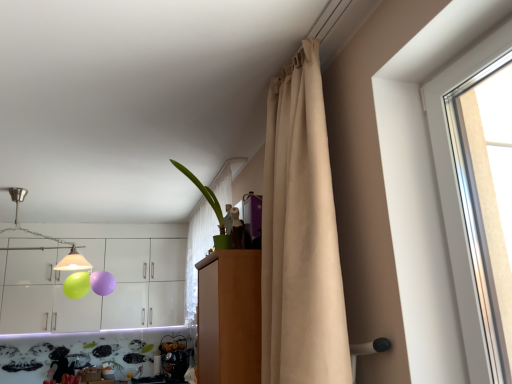
Question: Would you say brushed metal lampshade at upper left is outside wooden cabinet at center?

Choices:
 (A) yes
 (B) no

Answer: (A)

Question: Can you confirm if brushed metal lampshade at upper left is bigger than wooden cabinet at center?

Choices:
 (A) no
 (B) yes

Answer: (B)

Question: Is brushed metal lampshade at upper left next to wooden cabinet at center and touching it?

Choices:
 (A) no
 (B) yes

Answer: (A)

Question: Is brushed metal lampshade at upper left shorter than wooden cabinet at center?

Choices:
 (A) no
 (B) yes

Answer: (B)

Question: From the image's perspective, is brushed metal lampshade at upper left located above wooden cabinet at center?

Choices:
 (A) no
 (B) yes

Answer: (B)

Question: Is brushed metal lampshade at upper left turned away from wooden cabinet at center?

Choices:
 (A) yes
 (B) no

Answer: (B)

Question: Would you consider beige fabric curtain at upper right to be distant from green matte plant at upper center?

Choices:
 (A) no
 (B) yes

Answer: (A)

Question: Is beige fabric curtain at upper right located outside green matte plant at upper center?

Choices:
 (A) no
 (B) yes

Answer: (B)

Question: Considering the relative positions of beige fabric curtain at upper right and green matte plant at upper center in the image provided, is beige fabric curtain at upper right to the left of green matte plant at upper center from the viewer's perspective?

Choices:
 (A) yes
 (B) no

Answer: (B)

Question: Considering the relative sizes of beige fabric curtain at upper right and green matte plant at upper center in the image provided, is beige fabric curtain at upper right taller than green matte plant at upper center?

Choices:
 (A) yes
 (B) no

Answer: (A)

Question: Could you tell me if beige fabric curtain at upper right is facing green matte plant at upper center?

Choices:
 (A) no
 (B) yes

Answer: (A)

Question: Does beige fabric curtain at upper right touch green matte plant at upper center?

Choices:
 (A) yes
 (B) no

Answer: (B)

Question: From the image's perspective, does white glossy cabinets at upper left appear lower than brushed metal lampshade at upper left?

Choices:
 (A) yes
 (B) no

Answer: (A)